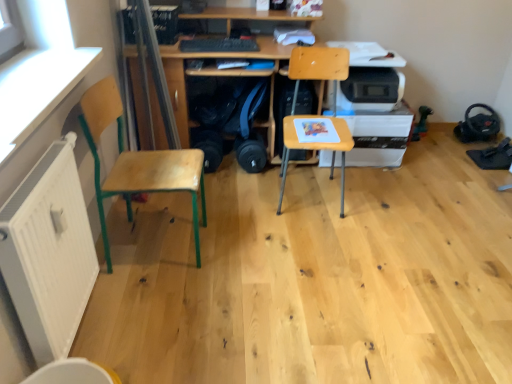
This screenshot has height=384, width=512. I want to click on free point in front of wooden desk at center, so click(x=251, y=225).